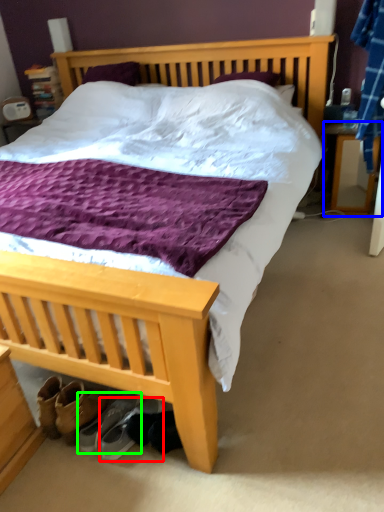
Question: Based on their relative distances, which object is farther from footwear (highlighted by a red box)? Choose from nightstand (highlighted by a blue box) and footwear (highlighted by a green box).

Choices:
 (A) nightstand
 (B) footwear

Answer: (A)